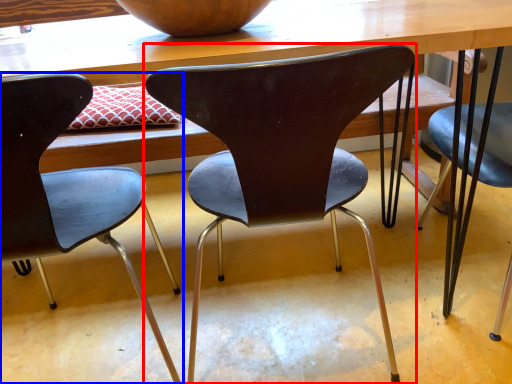
Question: Which object is closer to the camera taking this photo, chair (highlighted by a red box) or chair (highlighted by a blue box)?

Choices:
 (A) chair
 (B) chair

Answer: (B)